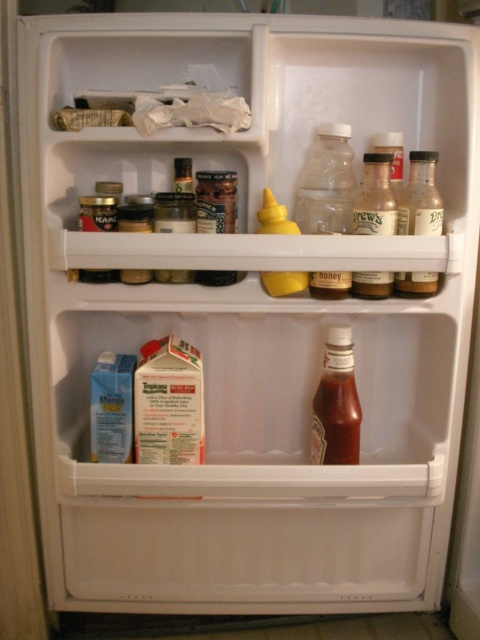
Is point (336, 406) positioned in front of point (433, 177)?

That is False.

Is shiny glass bottle of ketchup at center positioned in front of clear glass bottle at upper right?

No, shiny glass bottle of ketchup at center is behind clear glass bottle at upper right.

Is point (320, 420) less distant than point (411, 157)?

No, (320, 420) is further to viewer.

This screenshot has height=640, width=480. I want to click on shiny glass bottle of ketchup at center, so click(x=336, y=419).

Between point (326, 160) and point (320, 401), which one is positioned behind?

The point (320, 401) is more distant.

Which is in front, point (300, 209) or point (347, 426)?

Point (347, 426)

Is point (344, 138) farther from camera compared to point (334, 460)?

No.

You are a GUI agent. You are given a task and a screenshot of the screen. Output one action in this format:
    pyautogui.click(x=<x>, y=<y>)
    Task: Click on the translucent plastic bottle at center
    This screenshot has height=640, width=480.
    Given the screenshot: What is the action you would take?
    pyautogui.click(x=325, y=182)

Who is higher up, translucent plastic bottle at center or clear glass bottle at upper right?

translucent plastic bottle at center is above.

Which is below, translucent plastic bottle at center or clear glass bottle at upper right?

Positioned lower is clear glass bottle at upper right.

Describe the element at coordinates (325, 182) in the screenshot. I see `translucent plastic bottle at center` at that location.

Identify the location of translucent plastic bottle at center. (325, 182).